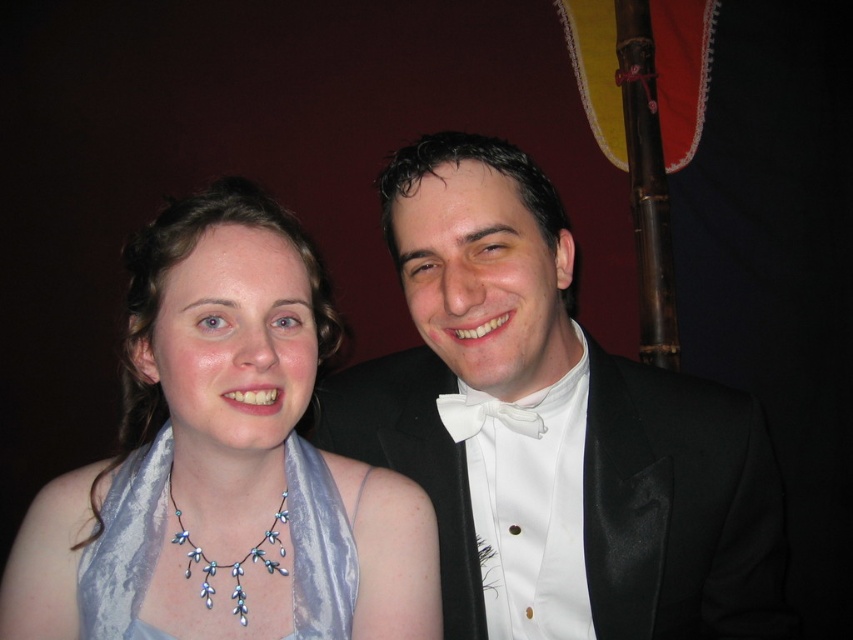
Question: Which of the following is the farthest from the observer?

Choices:
 (A) satin scarf at left
 (B) black satin tuxedo at center
 (C) silvery satin scarf at left

Answer: (C)

Question: Which object is the closest to the silvery satin scarf at left?

Choices:
 (A) satin scarf at left
 (B) white satin bow tie at center
 (C) shiny silver necklace at center

Answer: (C)

Question: Does black satin tuxedo at center have a lesser width compared to satin scarf at left?

Choices:
 (A) no
 (B) yes

Answer: (A)

Question: Is silvery satin scarf at left wider than shiny silver necklace at center?

Choices:
 (A) yes
 (B) no

Answer: (A)

Question: Is the position of black satin tuxedo at center more distant than that of white satin bow tie at center?

Choices:
 (A) yes
 (B) no

Answer: (B)

Question: Which is nearer to the black satin tuxedo at center?

Choices:
 (A) white satin bow tie at center
 (B) silvery satin scarf at left
 (C) satin scarf at left
 (D) shiny silver necklace at center

Answer: (A)